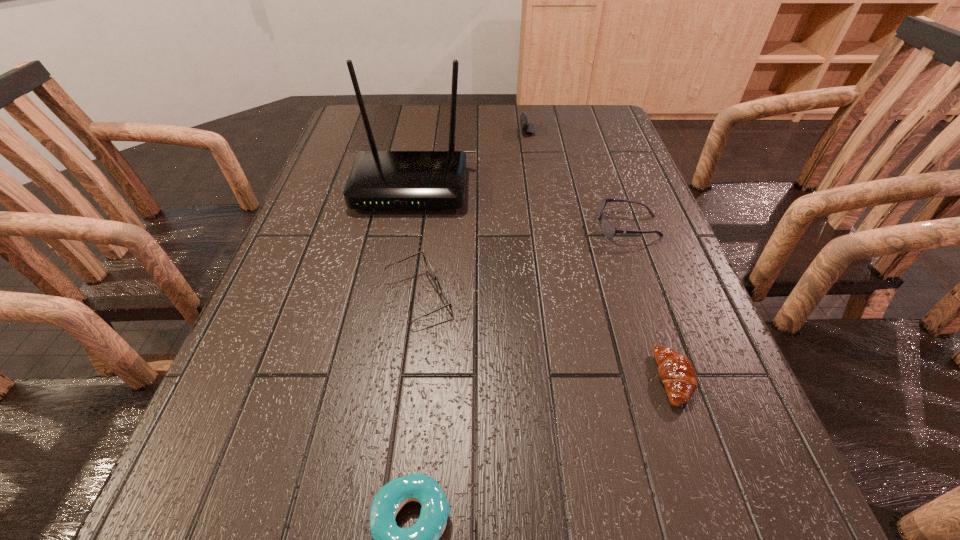
The height and width of the screenshot is (540, 960). In order to click on the third closest object to the sunglasses in this screenshot , I will do `click(445, 295)`.

This screenshot has width=960, height=540. Identify the location of the closest object relative to the farthest object. (378, 179).

The height and width of the screenshot is (540, 960). In order to click on vacant space that satisfies the following two spatial constraints: 1. on the front-facing side of the second nearest object; 2. on the left side of the webcam in this screenshot , I will do `click(614, 379)`.

This screenshot has width=960, height=540. Identify the location of vacant point that satisfies the following two spatial constraints: 1. on the front-facing side of the webcam; 2. on the left side of the second nearest object. (614, 379).